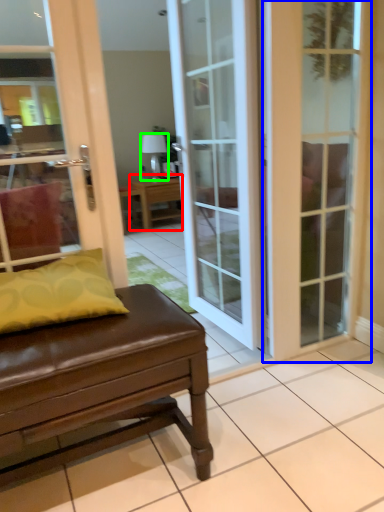
Question: Which is farther away from table (highlighted by a red box)? door (highlighted by a blue box) or lamp (highlighted by a green box)?

Choices:
 (A) door
 (B) lamp

Answer: (A)